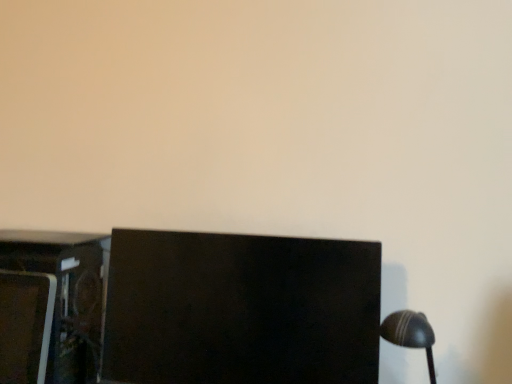
The image size is (512, 384). Describe the element at coordinates (51, 306) in the screenshot. I see `metallic dark brown cabinet at lower left` at that location.

I want to click on metallic dark brown cabinet at lower left, so [x=51, y=306].

Measure the distance between black glossy monitor at center and camera.

The depth of black glossy monitor at center is 36.06 inches.

The image size is (512, 384). What do you see at coordinates (240, 309) in the screenshot?
I see `black glossy monitor at center` at bounding box center [240, 309].

This screenshot has width=512, height=384. Identify the location of black glossy monitor at center. (240, 309).

The image size is (512, 384). I want to click on metallic dark brown cabinet at lower left, so click(x=51, y=306).

Is black glossy monitor at center to the left of metallic dark brown cabinet at lower left from the viewer's perspective?

In fact, black glossy monitor at center is to the right of metallic dark brown cabinet at lower left.

Is the depth of black glossy monitor at center less than that of metallic dark brown cabinet at lower left?

Yes, black glossy monitor at center is closer to the camera.

Which point is more forward, (347, 311) or (0, 251)?

The point (347, 311) is in front.

From the image's perspective, is black glossy monitor at center positioned above or below metallic dark brown cabinet at lower left?

From the image's perspective, black glossy monitor at center appears above metallic dark brown cabinet at lower left.

From a real-world perspective, is black glossy monitor at center above or below metallic dark brown cabinet at lower left?

Clearly, from a real-world perspective, black glossy monitor at center is above metallic dark brown cabinet at lower left.

Between black glossy monitor at center and metallic dark brown cabinet at lower left, which one has smaller width?

black glossy monitor at center is thinner.

Who is shorter, black glossy monitor at center or metallic dark brown cabinet at lower left?

Standing shorter between the two is black glossy monitor at center.

Considering the relative sizes of black glossy monitor at center and metallic dark brown cabinet at lower left in the image provided, is black glossy monitor at center bigger than metallic dark brown cabinet at lower left?

Indeed, black glossy monitor at center has a larger size compared to metallic dark brown cabinet at lower left.

Is black glossy monitor at center not within metallic dark brown cabinet at lower left?

Yes.

Is the surface of black glossy monitor at center in direct contact with metallic dark brown cabinet at lower left?

No, black glossy monitor at center is not making contact with metallic dark brown cabinet at lower left.

Could you tell me if black glossy monitor at center is facing metallic dark brown cabinet at lower left?

No, black glossy monitor at center does not turn towards metallic dark brown cabinet at lower left.

Can you tell me how much black glossy monitor at center and metallic dark brown cabinet at lower left differ in facing direction?

The angular difference between black glossy monitor at center and metallic dark brown cabinet at lower left is 1.14 degrees.

In the image, there is a black glossy monitor at center. At what (x,y) coordinates should I click in order to perform the action: click on furniture below it (from the image's perspective). Please return your answer as a coordinate pair (x, y). This screenshot has width=512, height=384. Looking at the image, I should click on (51, 306).

Considering the positions of objects metallic dark brown cabinet at lower left and black glossy monitor at center in the image provided, who is more to the left, metallic dark brown cabinet at lower left or black glossy monitor at center?

Positioned to the left is metallic dark brown cabinet at lower left.

Which object is further away from the camera taking this photo, metallic dark brown cabinet at lower left or black glossy monitor at center?

Positioned behind is metallic dark brown cabinet at lower left.

Considering the positions of point (20, 381) and point (365, 288), is point (20, 381) closer or farther from the camera than point (365, 288)?

Point (20, 381).

From the image's perspective, is metallic dark brown cabinet at lower left over black glossy monitor at center?

Actually, metallic dark brown cabinet at lower left appears below black glossy monitor at center in the image.

From a real-world perspective, relative to black glossy monitor at center, is metallic dark brown cabinet at lower left vertically above or below?

metallic dark brown cabinet at lower left is below black glossy monitor at center.

Is metallic dark brown cabinet at lower left thinner than black glossy monitor at center?

A: In fact, metallic dark brown cabinet at lower left might be wider than black glossy monitor at center.

Is metallic dark brown cabinet at lower left shorter than black glossy monitor at center?

No, metallic dark brown cabinet at lower left is not shorter than black glossy monitor at center.

Does metallic dark brown cabinet at lower left have a smaller size compared to black glossy monitor at center?

Indeed, metallic dark brown cabinet at lower left has a smaller size compared to black glossy monitor at center.

Would you say metallic dark brown cabinet at lower left is outside black glossy monitor at center?

Yes, metallic dark brown cabinet at lower left is outside of black glossy monitor at center.

Is metallic dark brown cabinet at lower left not near black glossy monitor at center?

metallic dark brown cabinet at lower left is actually quite close to black glossy monitor at center.

Is metallic dark brown cabinet at lower left facing towards black glossy monitor at center?

No.

In the scene shown: How different are the orientations of metallic dark brown cabinet at lower left and black glossy monitor at center in degrees?

The angular difference between metallic dark brown cabinet at lower left and black glossy monitor at center is 1.14 degrees.

Measure the distance from metallic dark brown cabinet at lower left to black glossy monitor at center.

They are 9.60 inches apart.

Where is `furniture that is behind the black glossy monitor at center`? This screenshot has height=384, width=512. furniture that is behind the black glossy monitor at center is located at coordinates (51, 306).

Where is `furniture on the left side of black glossy monitor at center`? The image size is (512, 384). furniture on the left side of black glossy monitor at center is located at coordinates (51, 306).

The width and height of the screenshot is (512, 384). I want to click on computer monitor above the metallic dark brown cabinet at lower left (from a real-world perspective), so click(240, 309).